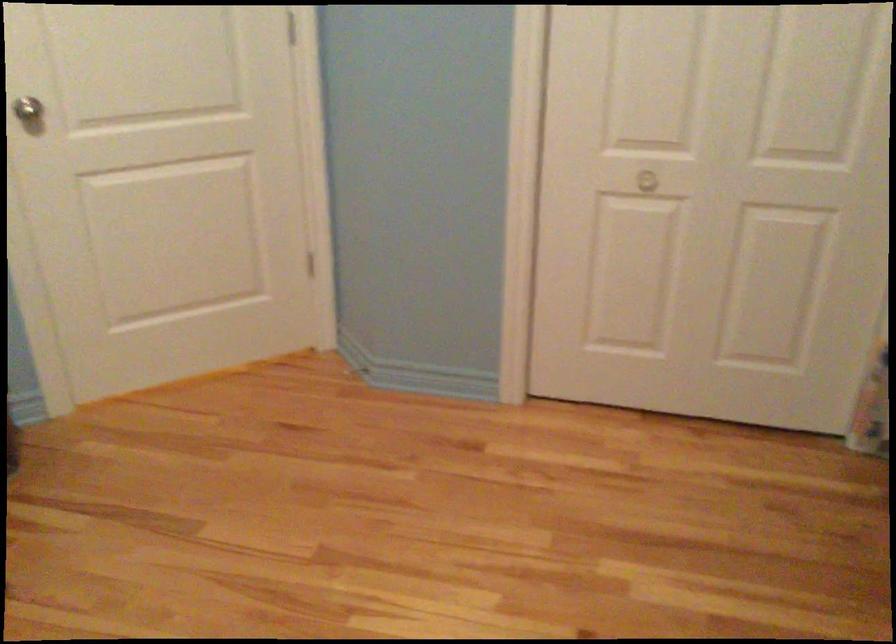
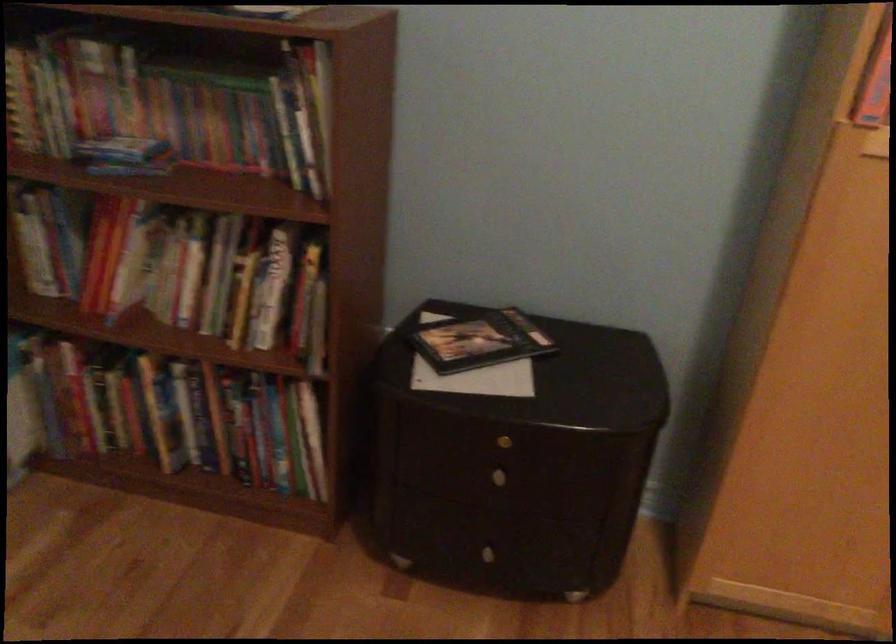
How did the camera likely rotate?

The camera rotated toward right-down.